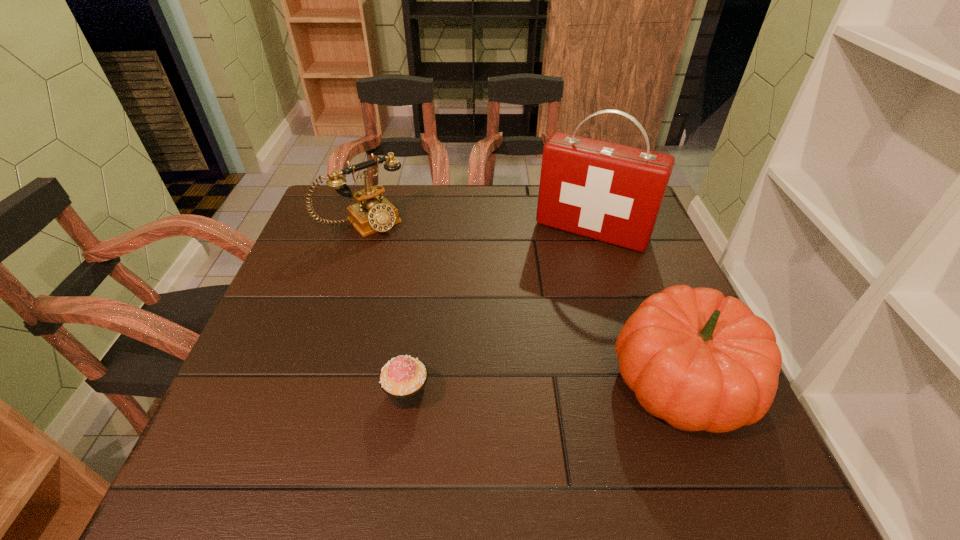
The width and height of the screenshot is (960, 540). Find the location of `empty space between the telephone and the first-aid kit`. empty space between the telephone and the first-aid kit is located at coordinates (478, 227).

The width and height of the screenshot is (960, 540). What are the coordinates of `free space that is in between the pumpkin and the shortest object` in the screenshot? It's located at (544, 387).

The height and width of the screenshot is (540, 960). I want to click on vacant area that lies between the tallest object and the third object from right to left, so click(x=499, y=313).

Locate an element on the screen. This screenshot has width=960, height=540. empty space between the third object from right to left and the leftmost object is located at coordinates (386, 308).

The height and width of the screenshot is (540, 960). In order to click on vacant point located between the leftmost object and the cupcake in this screenshot , I will do `click(386, 308)`.

This screenshot has width=960, height=540. Find the location of `free space between the pumpkin and the cupcake`. free space between the pumpkin and the cupcake is located at coordinates (544, 387).

The height and width of the screenshot is (540, 960). What are the coordinates of `free space that is in between the pumpkin and the first-aid kit` in the screenshot? It's located at (636, 305).

Identify the location of unoccupied position between the telephone and the first-aid kit. (478, 227).

Select which object is the closest to the shortest object. Please provide its 2D coordinates. Your answer should be formatted as a tuple, i.e. [(x, y)], where the tuple contains the x and y coordinates of a point satisfying the conditions above.

[(698, 360)]

Where is `object that is the closest one to the telephone`? Image resolution: width=960 pixels, height=540 pixels. object that is the closest one to the telephone is located at coordinates (609, 192).